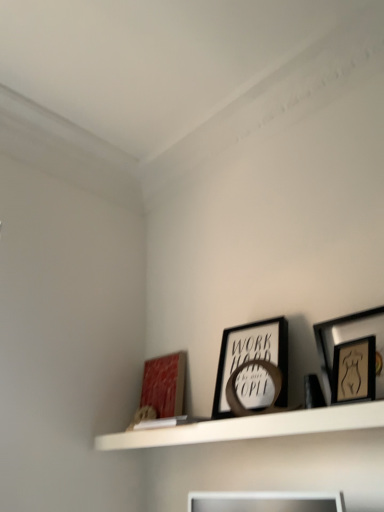
Question: Is wooden framed artwork at upper right, which ranks as the first picture frame in front-to-back order, facing away from matte red picture frame at lower left, the first picture frame positioned from the back?

Choices:
 (A) no
 (B) yes

Answer: (A)

Question: Is wooden framed artwork at upper right, marked as the first picture frame in a right-to-left arrangement, bigger than matte red picture frame at lower left, the third picture frame viewed from the front?

Choices:
 (A) yes
 (B) no

Answer: (A)

Question: Is wooden framed artwork at upper right, acting as the 3th picture frame starting from the back, smaller than matte red picture frame at lower left, the first picture frame positioned from the back?

Choices:
 (A) no
 (B) yes

Answer: (A)

Question: Does wooden framed artwork at upper right, acting as the 3th picture frame starting from the back, contain matte red picture frame at lower left, placed as the 3th picture frame when sorted from right to left?

Choices:
 (A) no
 (B) yes

Answer: (A)

Question: Is the depth of wooden framed artwork at upper right, marked as the first picture frame in a right-to-left arrangement, greater than that of matte red picture frame at lower left, the third picture frame viewed from the front?

Choices:
 (A) yes
 (B) no

Answer: (B)

Question: Is wooden framed artwork at upper right, marked as the first picture frame in a right-to-left arrangement, far from matte red picture frame at lower left, the first picture frame positioned from the back?

Choices:
 (A) yes
 (B) no

Answer: (B)

Question: From the image's perspective, would you say black matte picture frame at center, marked as the second picture frame in a left-to-right arrangement, is shown under white matte shelf at upper center?

Choices:
 (A) no
 (B) yes

Answer: (A)

Question: From a real-world perspective, does black matte picture frame at center, marked as the second picture frame in a left-to-right arrangement, sit lower than white matte shelf at upper center?

Choices:
 (A) no
 (B) yes

Answer: (A)

Question: Is black matte picture frame at center, marked as the second picture frame in a left-to-right arrangement, in front of white matte shelf at upper center?

Choices:
 (A) yes
 (B) no

Answer: (B)

Question: Can white matte shelf at upper center be found inside black matte picture frame at center, the second picture frame when ordered from right to left?

Choices:
 (A) no
 (B) yes

Answer: (A)

Question: Is black matte picture frame at center, which is the second picture frame from front to back, to the left of white matte shelf at upper center from the viewer's perspective?

Choices:
 (A) no
 (B) yes

Answer: (A)

Question: Is black matte picture frame at center, the second picture frame when ordered from right to left, bigger than white matte shelf at upper center?

Choices:
 (A) no
 (B) yes

Answer: (A)

Question: Is white matte shelf at upper center next to wooden framed artwork at upper right, marked as the first picture frame in a right-to-left arrangement?

Choices:
 (A) yes
 (B) no

Answer: (B)